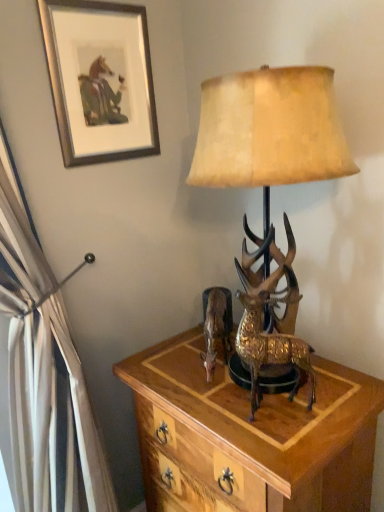
Identify the location of vacant space in front of metallic gold reindeer at center. (218, 397).